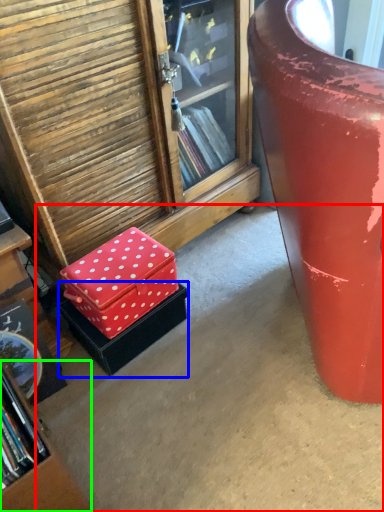
Question: Estimate the real-world distances between objects in this image. Which object is closer to concrete (highlighted by a red box), box (highlighted by a blue box) or bookcase (highlighted by a green box)?

Choices:
 (A) box
 (B) bookcase

Answer: (A)